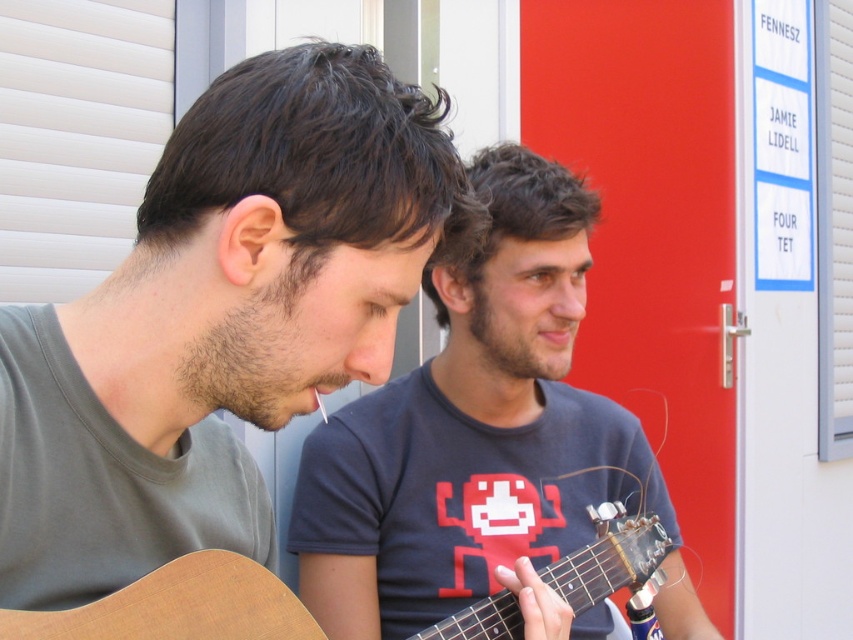
Question: Does matte brown guitar at left appear on the left side of wooden acoustic guitar at center?

Choices:
 (A) no
 (B) yes

Answer: (B)

Question: Does matte brown guitar at left appear on the right side of dark blue t-shirt at center?

Choices:
 (A) yes
 (B) no

Answer: (B)

Question: Estimate the real-world distances between objects in this image. Which object is farther from the wooden acoustic guitar at center?

Choices:
 (A) dark blue t-shirt at center
 (B) matte brown guitar at left

Answer: (B)

Question: Is matte brown guitar at left above dark blue t-shirt at center?

Choices:
 (A) no
 (B) yes

Answer: (B)

Question: Considering the real-world distances, which object is closest to the wooden acoustic guitar at center?

Choices:
 (A) matte brown guitar at left
 (B) dark blue t-shirt at center

Answer: (B)

Question: Which of the following is the farthest from the observer?

Choices:
 (A) matte brown guitar at left
 (B) dark blue t-shirt at center
 (C) wooden acoustic guitar at center

Answer: (B)